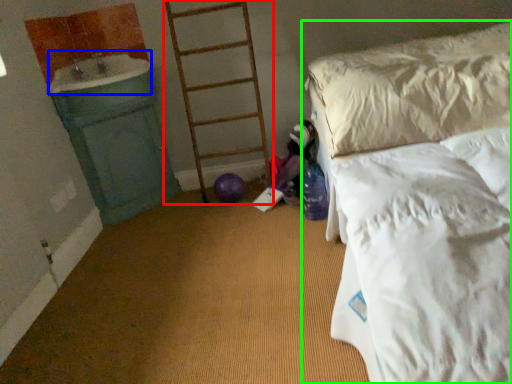
Question: Based on their relative distances, which object is farther from ladder (highlighted by a red box)? Choose from sink (highlighted by a blue box) and bed (highlighted by a green box).

Choices:
 (A) sink
 (B) bed

Answer: (B)